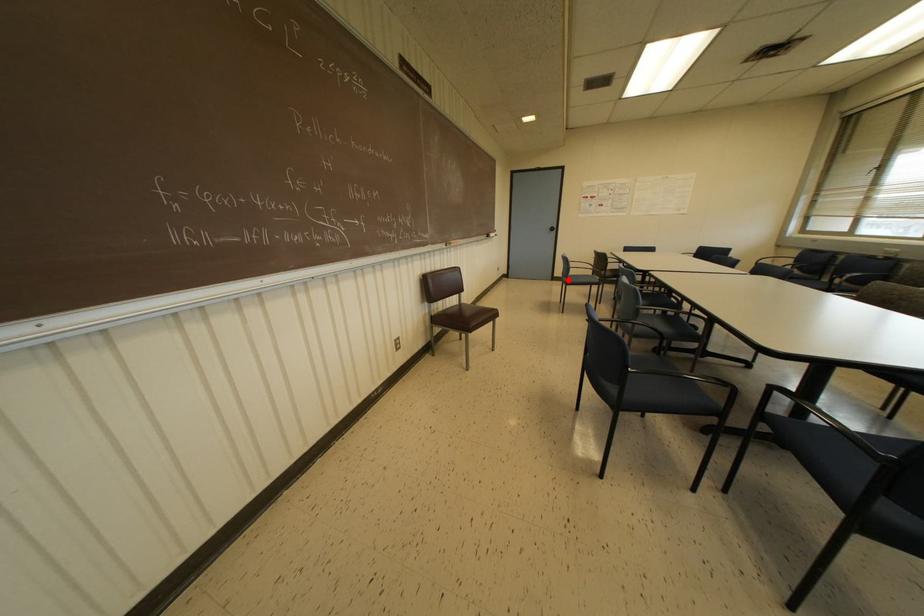
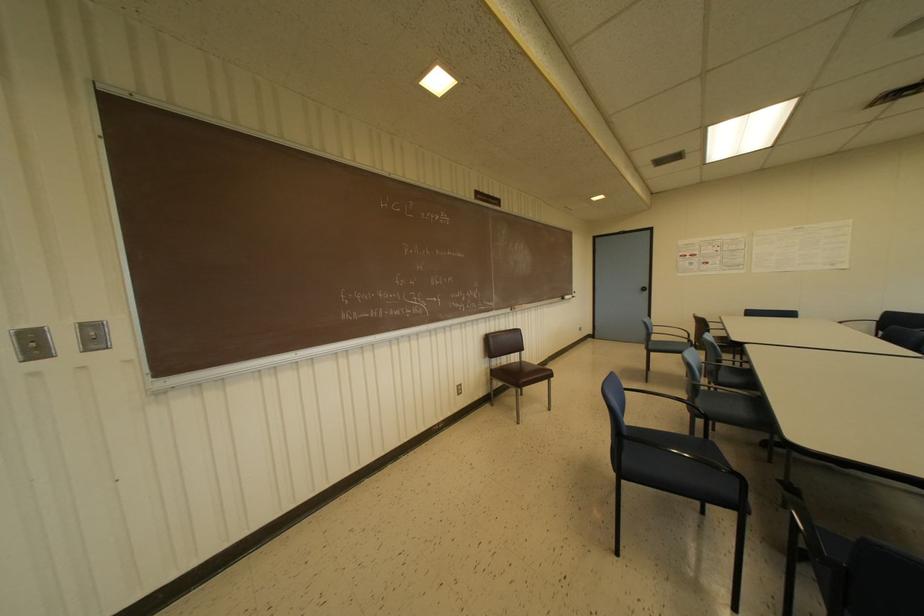
Question: I am providing you with two images of the same scene from different viewpoints. Image1 has a red point marked. In image2, the corresponding 3D location appears at what relative position? Reply with the corresponding letter.

Choices:
 (A) Closer
 (B) Farther

Answer: (B)